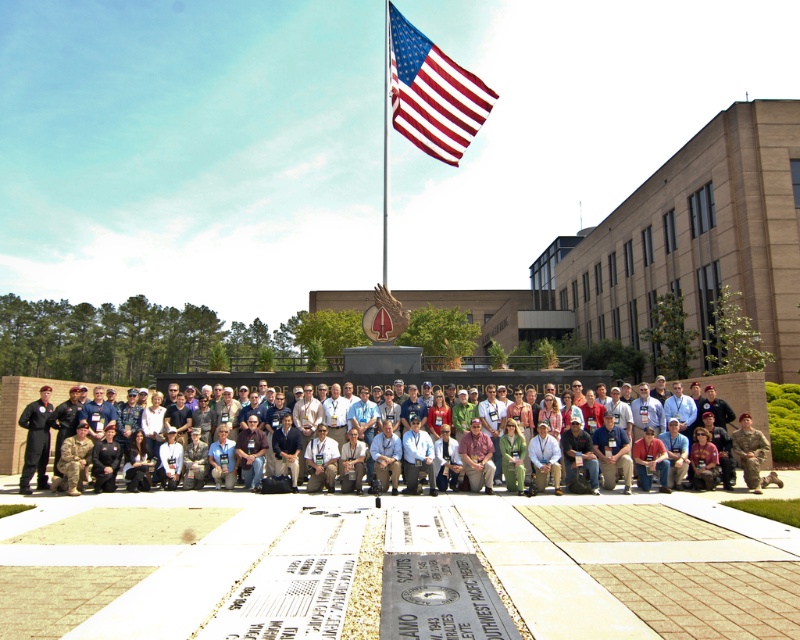
In the scene shown: You are a photographer trying to capture a clear shot of the camouflage uniform at center and the metallic flag pole at upper center. Based on their sizes in the image, which one would appear smaller in the photo?

The camouflage uniform at center appears smaller in the photo because it is not as tall as the metallic flag pole at upper center.